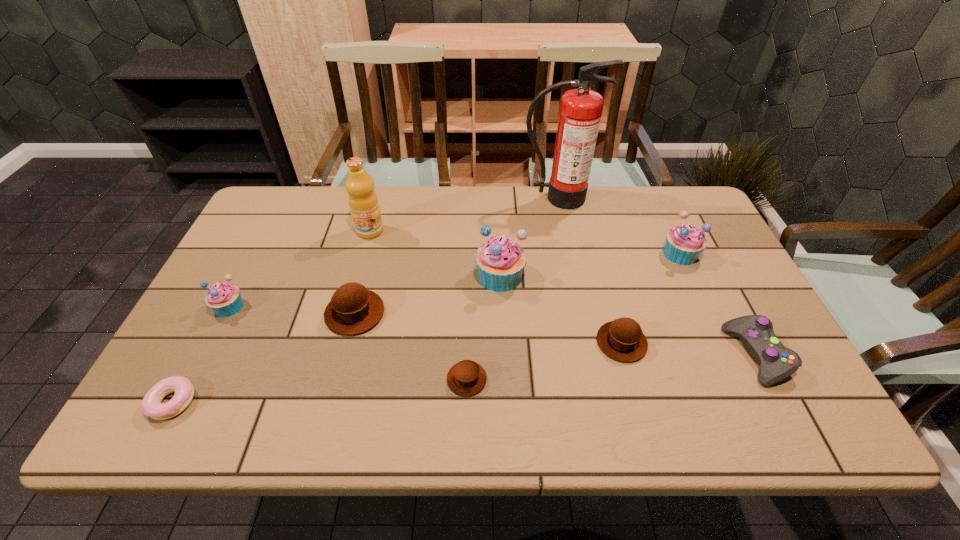
This screenshot has height=540, width=960. What are the coordinates of `the fifth muffin from right to left` in the screenshot? It's located at 353,309.

Where is `the leftmost brown muffin`? Image resolution: width=960 pixels, height=540 pixels. the leftmost brown muffin is located at coordinates (353, 309).

The height and width of the screenshot is (540, 960). Identify the location of the second biggest brown muffin. (623, 340).

The image size is (960, 540). What are the coordinates of `the rightmost brown muffin` in the screenshot? It's located at (623, 340).

You are a GUI agent. You are given a task and a screenshot of the screen. Output one action in this format:
    pyautogui.click(x=<x>, y=<y>)
    Task: Click on the gray control
    
    Given the screenshot: What is the action you would take?
    pyautogui.click(x=756, y=333)

Where is `the second shortest object`? the second shortest object is located at coordinates (466, 378).

Image resolution: width=960 pixels, height=540 pixels. Find the location of `the smallest brown muffin`. the smallest brown muffin is located at coordinates [x=466, y=378].

Locate an element on the screen. doughnut is located at coordinates (151, 405).

The width and height of the screenshot is (960, 540). I want to click on the shortest object, so click(x=151, y=405).

Identify the location of vacant space located 0.340m on the front-facing side of the red fire extinguisher. (575, 287).